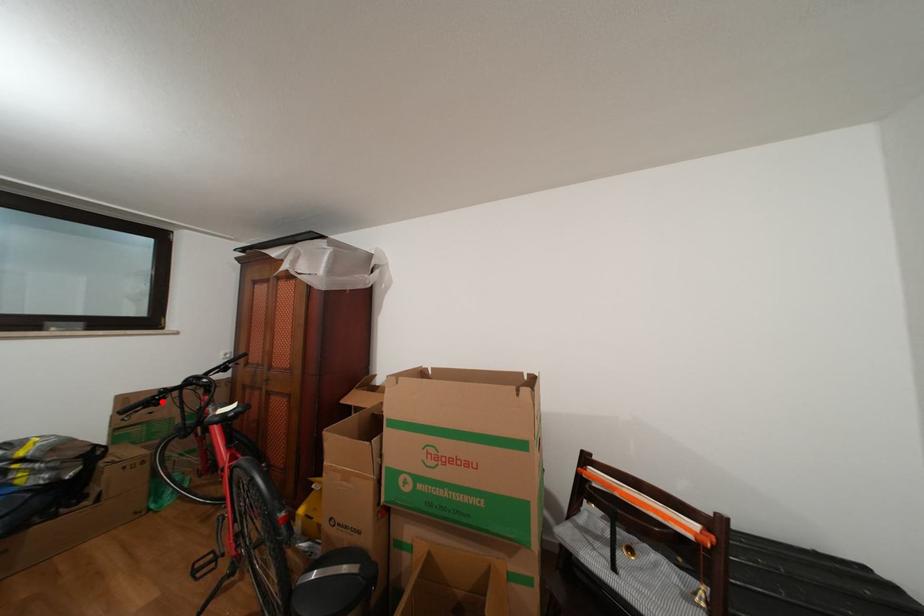
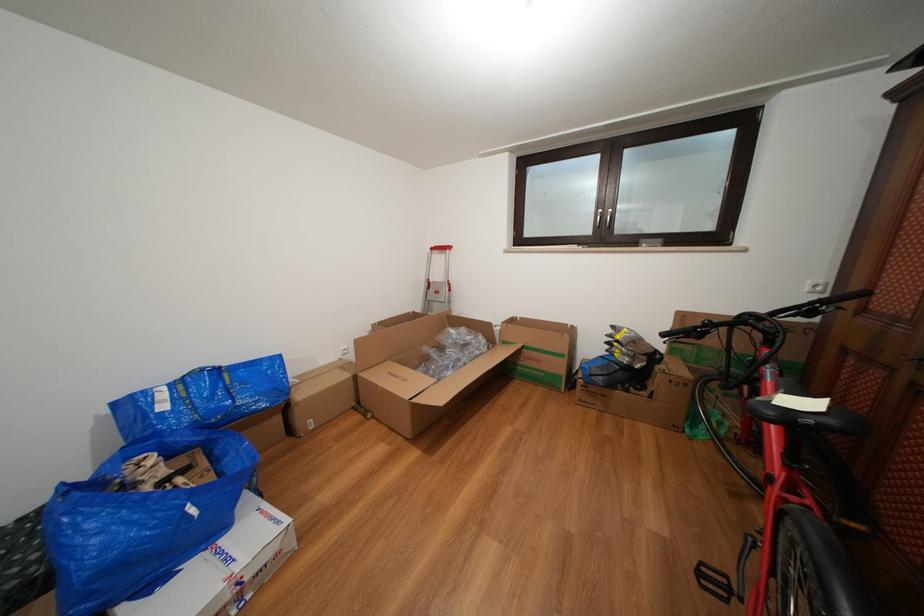
The point at the highlighted location is marked in the first image. Where is the corresponding point in the second image?

(703, 333)